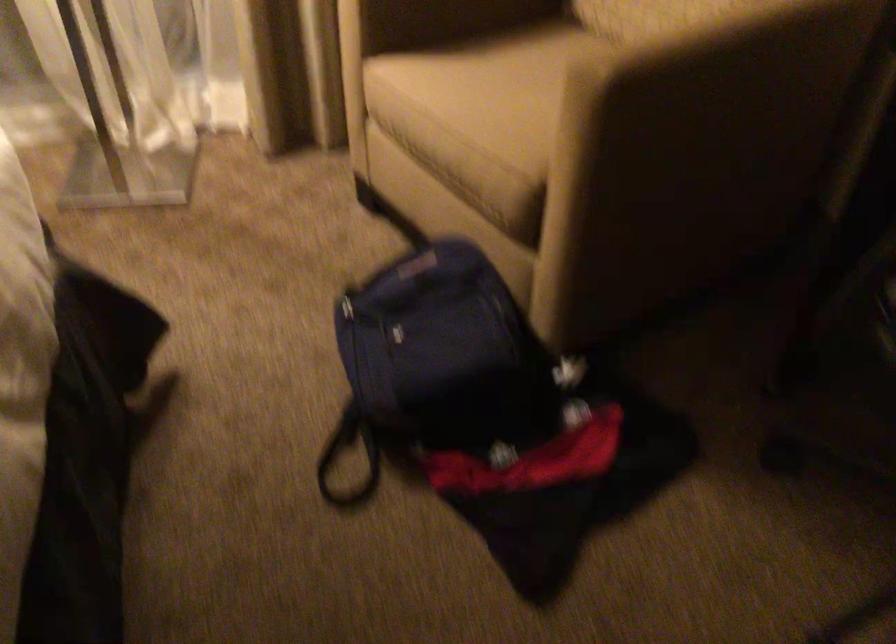
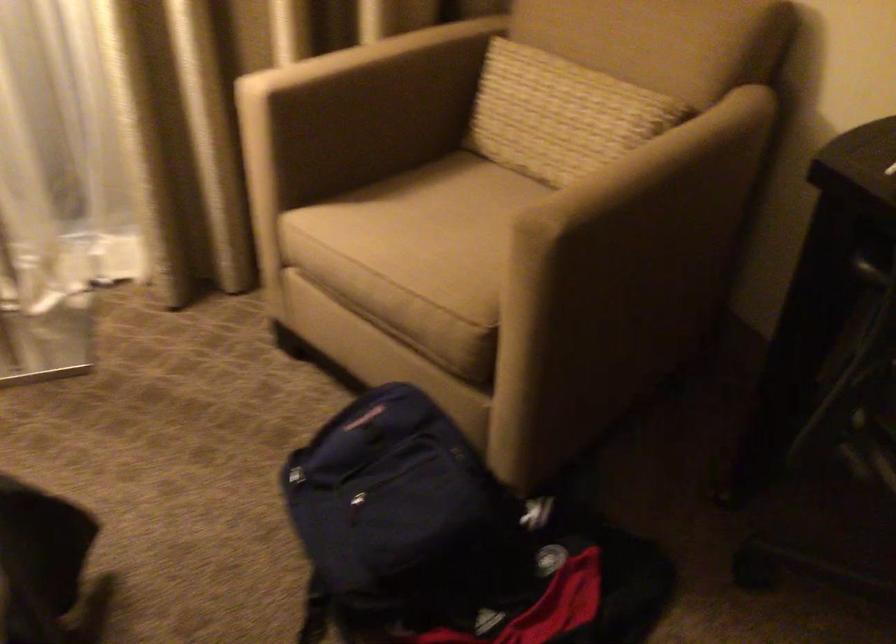
Question: What movement of the cameraman would produce the second image?

Choices:
 (A) Left
 (B) Right
 (C) Forward
 (D) Backward

Answer: (A)